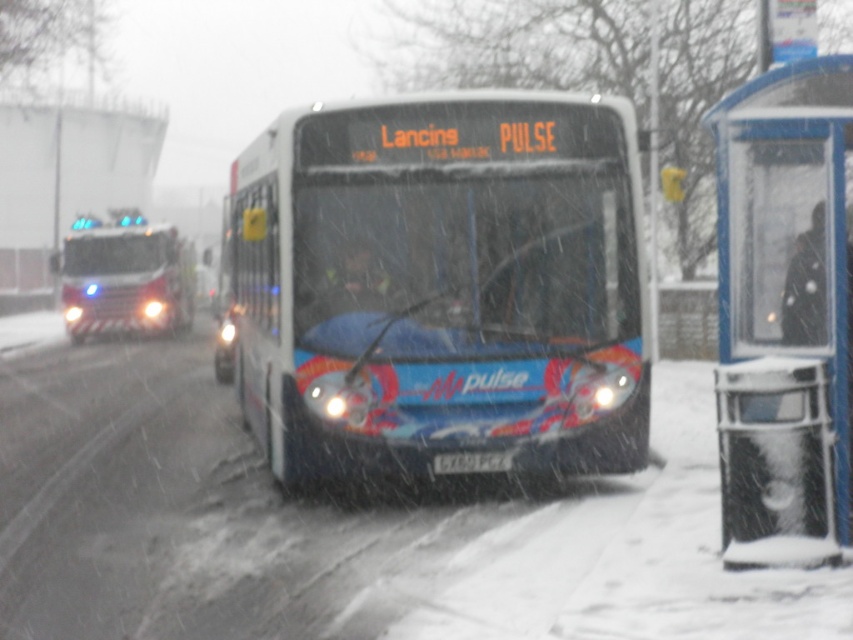
Does point (236, 230) lie in front of point (741, 99)?

That is False.

In order to click on blue glossy bus at center in this screenshot , I will do `click(444, 285)`.

Which is in front, point (291, 440) or point (148, 275)?

Point (291, 440) is more forward.

Where is `blue glossy bus at center`? This screenshot has width=853, height=640. blue glossy bus at center is located at coordinates (444, 285).

Measure the distance between point [341,342] and camera.

The distance of point [341,342] from camera is 8.81 meters.

You are a GUI agent. You are given a task and a screenshot of the screen. Output one action in this format:
    pyautogui.click(x=<x>, y=<y>)
    Task: Click on the blue glossy bus at center
    
    Given the screenshot: What is the action you would take?
    pyautogui.click(x=444, y=285)

Does blue plastic bus stop at right have a greater width compared to red firetruck at left?

Yes, blue plastic bus stop at right is wider than red firetruck at left.

Does blue plastic bus stop at right come behind red firetruck at left?

No.

Who is more distant from viewer, (825, 138) or (135, 305)?

Positioned behind is point (135, 305).

Locate an element on the screen. This screenshot has width=853, height=640. blue plastic bus stop at right is located at coordinates (785, 314).